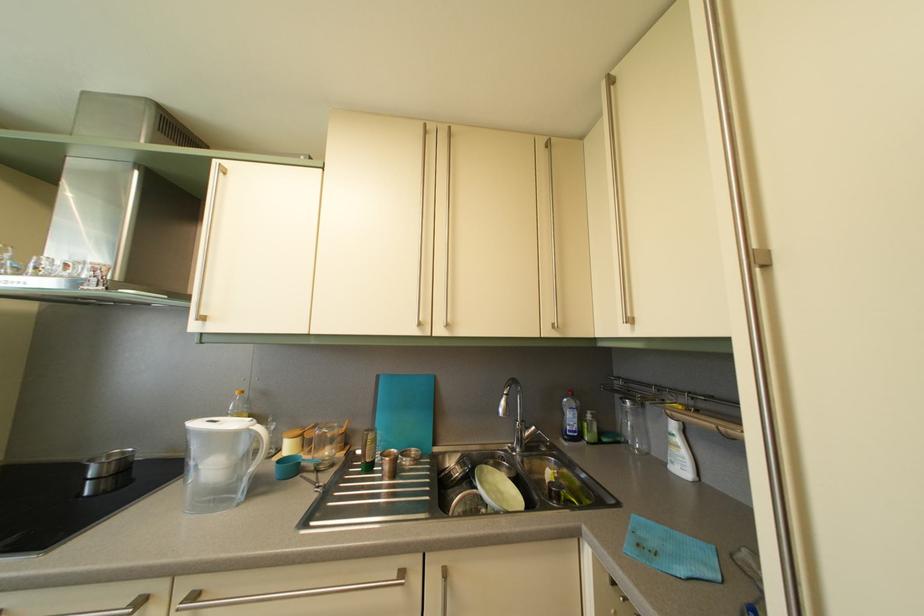
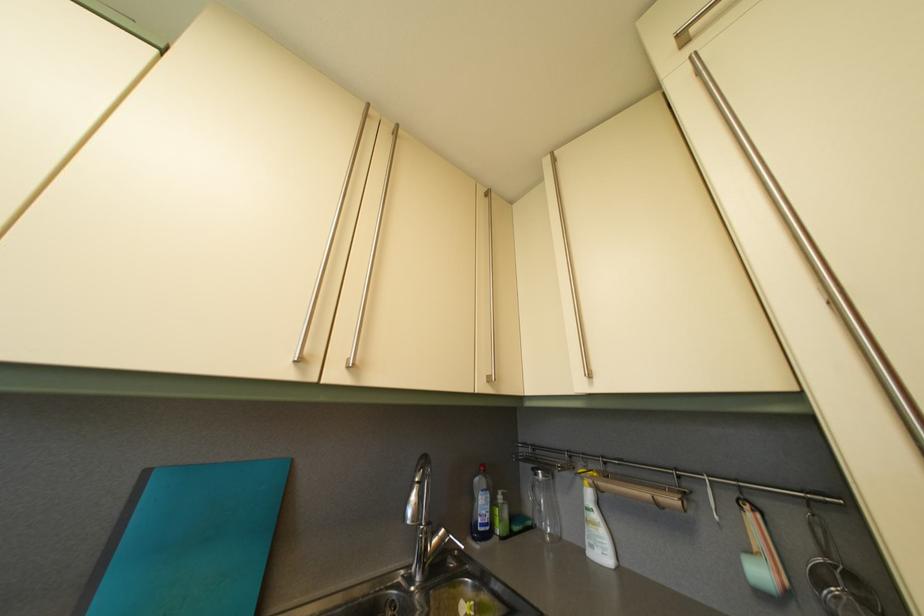
First-person continuous shooting, in which direction is the camera rotating?

The camera rotated toward right-up.